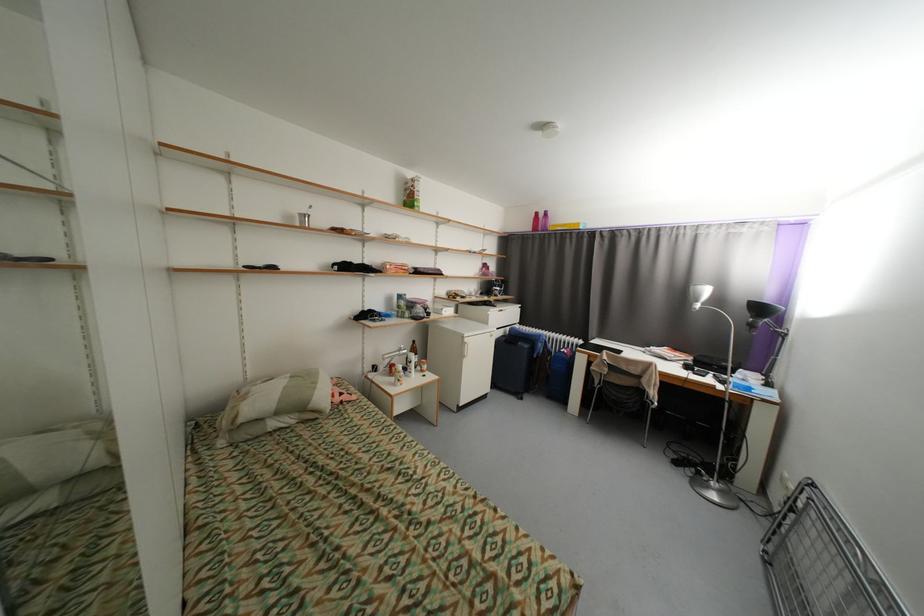
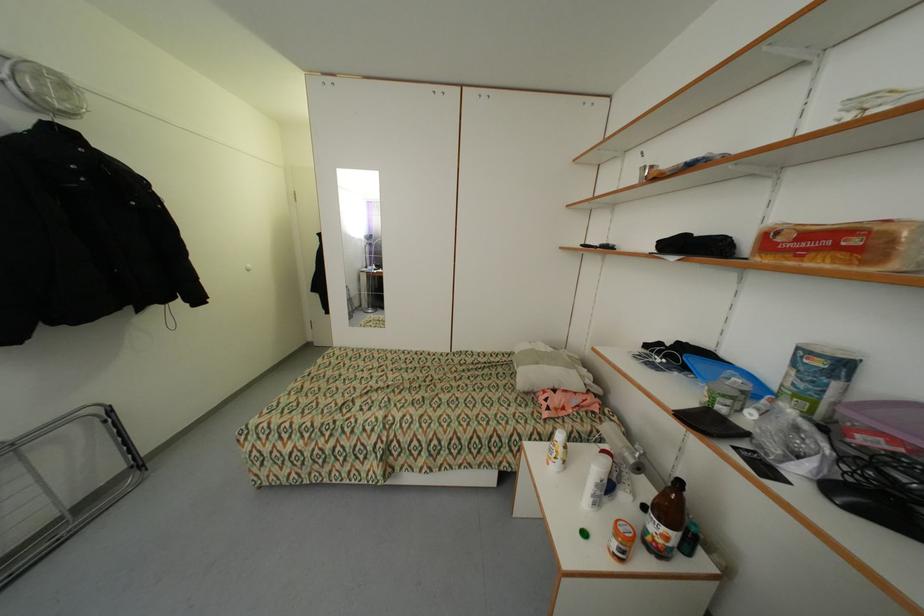
Locate, in the second image, the point that corresponds to pixel 410 270 in the first image.

(860, 241)